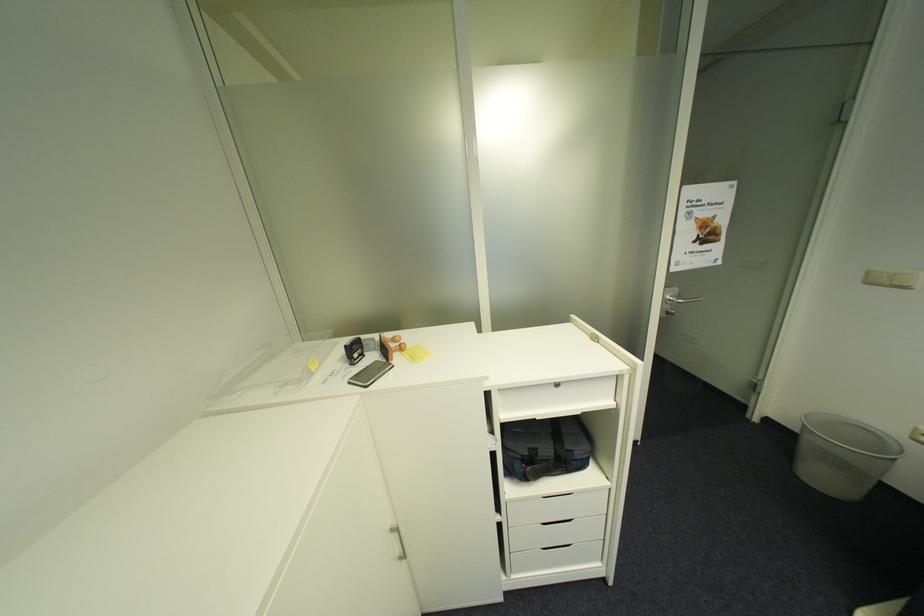
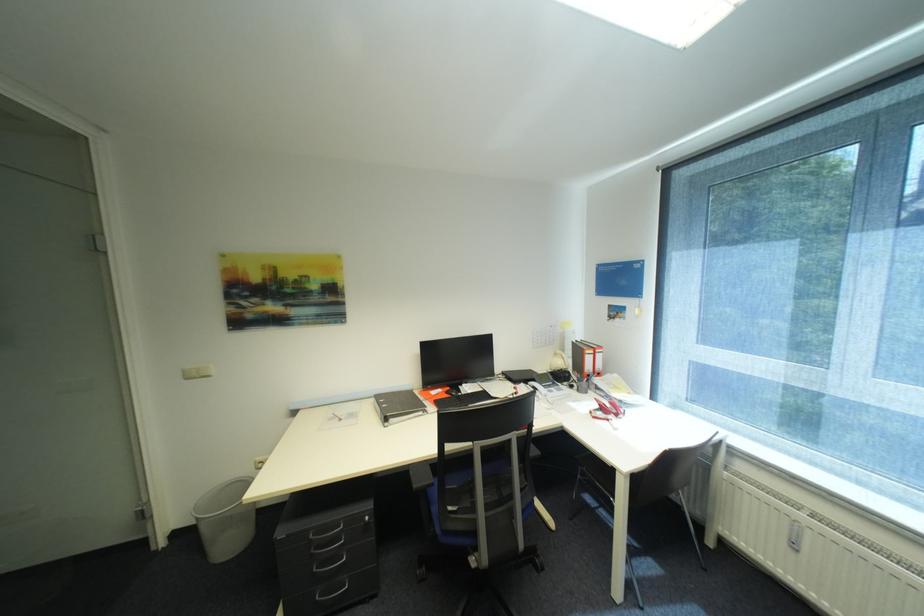
Question: How did the camera likely rotate?

Choices:
 (A) Left
 (B) Right
 (C) Up
 (D) Down

Answer: (B)